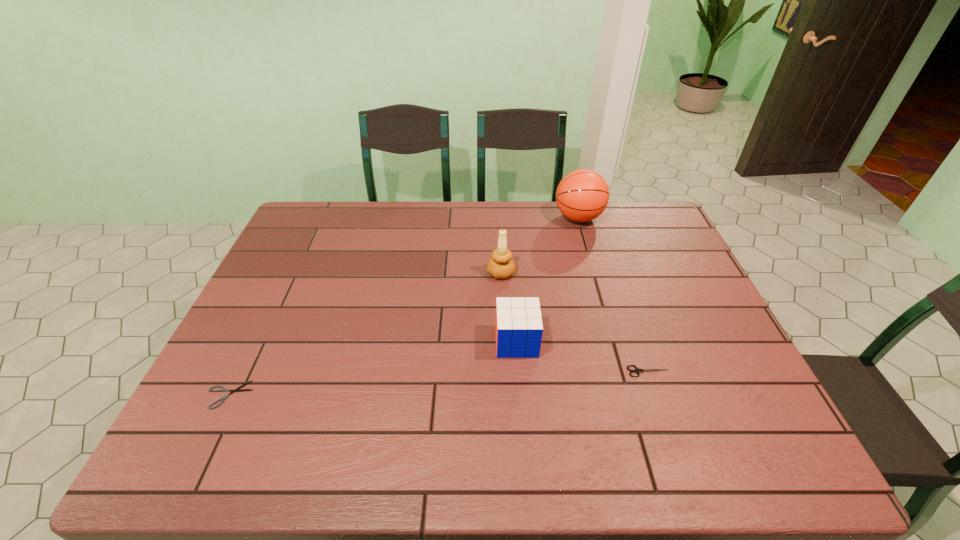
Image resolution: width=960 pixels, height=540 pixels. Identify the location of basketball. (582, 195).

You are a GUI agent. You are given a task and a screenshot of the screen. Output one action in this format:
    pyautogui.click(x=<x>, y=<y>)
    Task: Click on the candle_holder
    The width and height of the screenshot is (960, 540).
    Given the screenshot: What is the action you would take?
    pyautogui.click(x=501, y=266)

Image resolution: width=960 pixels, height=540 pixels. Find the location of `the third shortest object`. the third shortest object is located at coordinates (519, 329).

You are a GUI agent. You are given a task and a screenshot of the screen. Output one action in this format:
    pyautogui.click(x=<x>, y=<y>)
    Task: Click on the cube
    The width and height of the screenshot is (960, 540).
    Given the screenshot: What is the action you would take?
    pyautogui.click(x=519, y=329)

The image size is (960, 540). I want to click on the taller shears, so click(637, 370).

Identify the location of the fourth farthest object. The image size is (960, 540). (637, 370).

Identify the location of the left shears. This screenshot has width=960, height=540. (238, 389).

The width and height of the screenshot is (960, 540). Identify the location of the leftmost object. (238, 389).

Where is `vacant area situated 0.380m on the front of the farthest object`? vacant area situated 0.380m on the front of the farthest object is located at coordinates (607, 314).

Find the location of a particular element. The width and height of the screenshot is (960, 540). free space located on the back of the second farthest object is located at coordinates (499, 232).